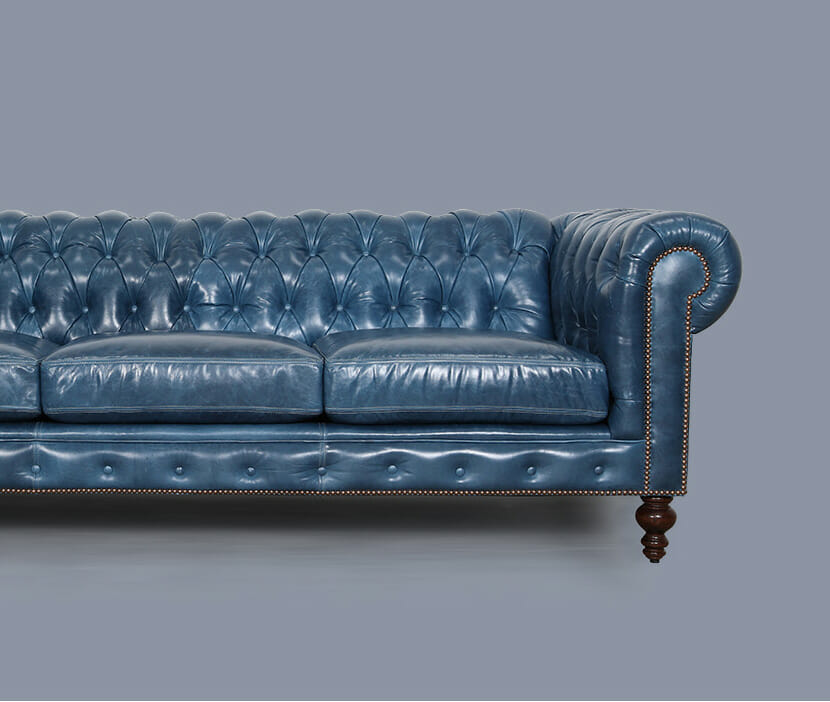
Locate an element on the screen. wooden leg is located at coordinates (651, 523).